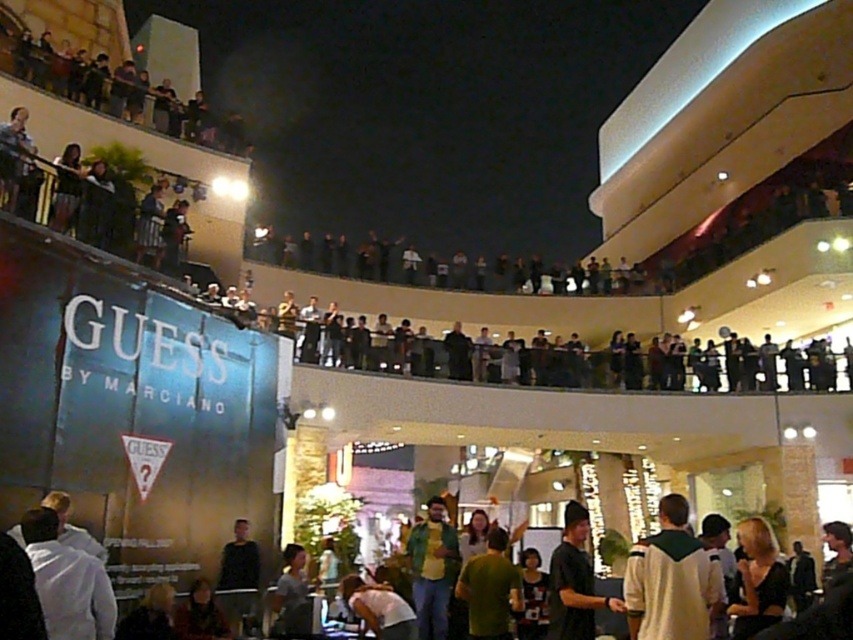
Question: Based on their relative distances, which object is farther from the green textured shirt at center?

Choices:
 (A) dark gray t-shirt at center
 (B) green shirt at center
 (C) white matte jacket at lower left

Answer: (C)

Question: Which point appears closest to the camera in this image?

Choices:
 (A) (47, 531)
 (B) (431, 634)

Answer: (A)

Question: Is green shirt at center to the right of dark gray hoodie at lower center from the viewer's perspective?

Choices:
 (A) no
 (B) yes

Answer: (B)

Question: Does white matte jacket at lower left lie behind white fabric shirt at lower center?

Choices:
 (A) no
 (B) yes

Answer: (A)

Question: Which point is closer to the camera taking this photo?

Choices:
 (A) (631, 618)
 (B) (824, 604)
 (C) (392, 604)
 (D) (45, 573)

Answer: (B)

Question: Does white matte jacket at lower left appear on the left side of green matte shirt at center?

Choices:
 (A) no
 (B) yes

Answer: (B)